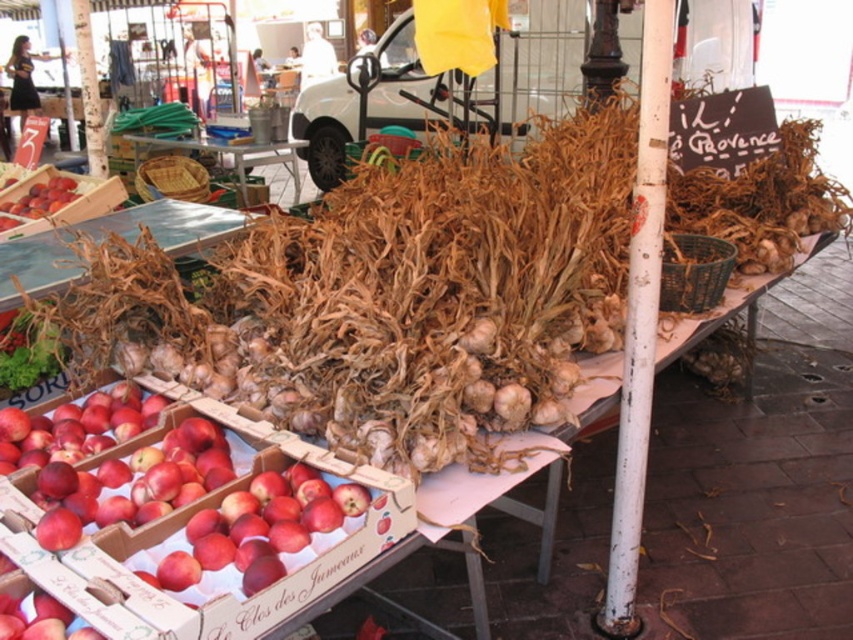
You are standing at the point marked by the coordinates point (3, 388) in the market scene. You want to pick up a red apple from the boxes labeled Le Clos des Jumeaux located to the left of the garlic. Can you reach the apples without moving your feet?

The point marked by the coordinates point (3, 388) is 7.68 feet away from the viewer. Since you are standing at that point, the distance between you and the apples is 7.68 feet. It is unlikely you can reach the apples without moving your feet because the distance is too far for typical arm reach.

You are a customer at the market and want to pick up the shiny red apples at lower left. Can you reach them without moving the green leafy vegetable at lower left?

The shiny red apples at lower left are in front of the green leafy vegetable at lower left, so you can reach them without moving the green leafy vegetable at lower left.